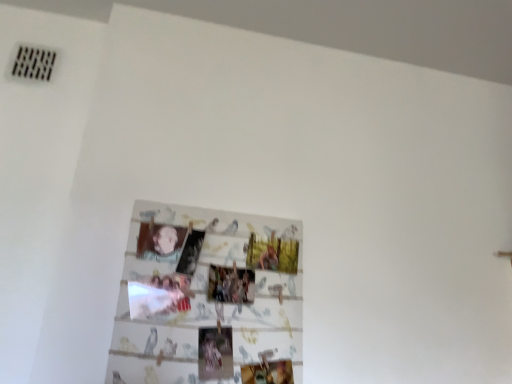
Question: Visually, is smooth beige baby at center positioned to the left or to the right of wooden photo collage at center?

Choices:
 (A) left
 (B) right

Answer: (A)

Question: Based on their sizes in the image, would you say smooth beige baby at center is bigger or smaller than wooden photo collage at center?

Choices:
 (A) big
 (B) small

Answer: (B)

Question: From a real-world perspective, is smooth beige baby at center physically located above or below wooden photo collage at center?

Choices:
 (A) above
 (B) below

Answer: (A)

Question: Relative to smooth beige baby at center, is wooden photo collage at center in front or behind?

Choices:
 (A) behind
 (B) front

Answer: (B)

Question: Looking at the image, does wooden photo collage at center seem bigger or smaller compared to smooth beige baby at center?

Choices:
 (A) big
 (B) small

Answer: (A)

Question: Considering the positions of wooden photo collage at center and smooth beige baby at center in the image, is wooden photo collage at center wider or thinner than smooth beige baby at center?

Choices:
 (A) wide
 (B) thin

Answer: (A)

Question: Would you say wooden photo collage at center is inside or outside smooth beige baby at center?

Choices:
 (A) outside
 (B) inside

Answer: (A)